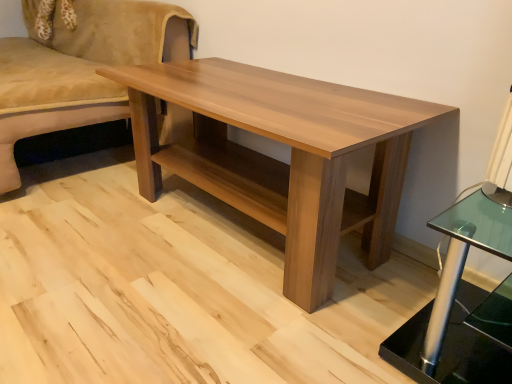
Question: Is point (116, 102) positioned closer to the camera than point (392, 230)?

Choices:
 (A) closer
 (B) farther

Answer: (B)

Question: From a real-world perspective, is suede beige studio couch at upper left positioned above or below light brown wood coffee table at center?

Choices:
 (A) above
 (B) below

Answer: (A)

Question: From their relative heights in the image, would you say suede beige studio couch at upper left is taller or shorter than light brown wood coffee table at center?

Choices:
 (A) tall
 (B) short

Answer: (A)

Question: From a real-world perspective, is light brown wood coffee table at center physically located above or below suede beige studio couch at upper left?

Choices:
 (A) below
 (B) above

Answer: (A)

Question: From the image's perspective, is light brown wood coffee table at center positioned above or below suede beige studio couch at upper left?

Choices:
 (A) above
 (B) below

Answer: (B)

Question: Based on their positions, is light brown wood coffee table at center located to the left or right of suede beige studio couch at upper left?

Choices:
 (A) right
 (B) left

Answer: (A)

Question: In terms of width, does light brown wood coffee table at center look wider or thinner when compared to suede beige studio couch at upper left?

Choices:
 (A) wide
 (B) thin

Answer: (B)